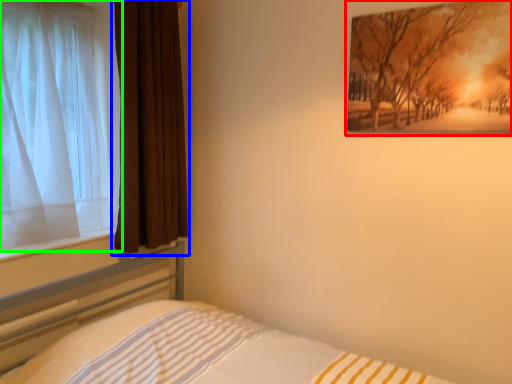
Question: Considering the real-world distances, which object is farthest from picture frame (highlighted by a red box)? curtain (highlighted by a blue box) or curtain (highlighted by a green box)?

Choices:
 (A) curtain
 (B) curtain

Answer: (B)